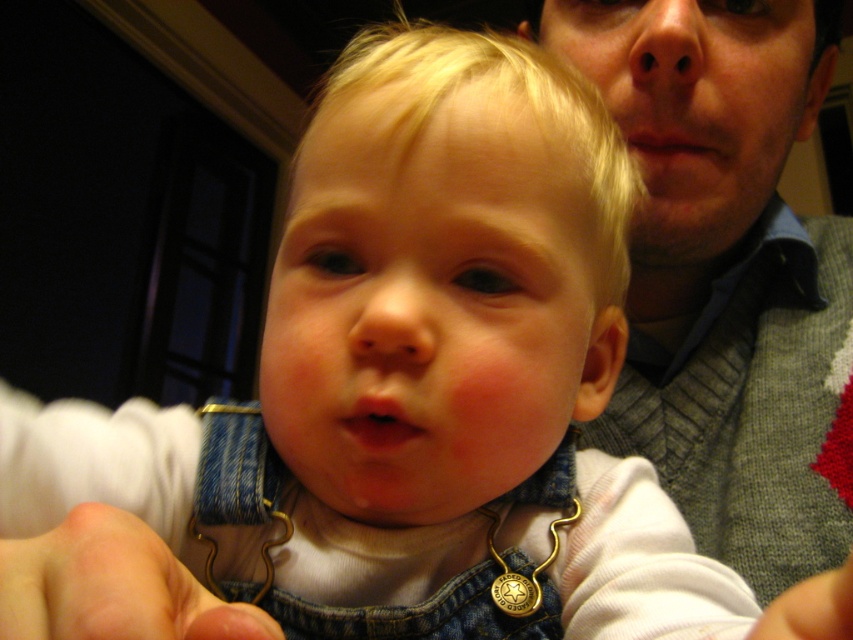
You are holding a small stuffed animal that is 20 centimeters wide. You want to place it on the floor so that it is exactly halfway between you and the point at point (659,76). Can you do that?

The distance between you and point (659,76) is 45.66 centimeters. Half of that distance is 22.83 centimeters. Since the stuffed animal is 20 centimeters wide, placing it at the halfway point would leave enough space. Yes, you can place the stuffed animal exactly halfway between you and point (659,76).

You are taking a photo of the child and need to focus on the points in the image. Which point is closer to the camera, point (177, 573) or point (850, 557)?

Point (177, 573) is further to the camera than point (850, 557), so the closer point to the camera is point (850, 557).

You are a photographer checking the composition of this image. You notice the gray knitted sweater at upper right and the fuzzy white hand at lower left. Which object is closer to the camera?

The gray knitted sweater at upper right is closer to the camera than the fuzzy white hand at lower left because it is further to the viewer.